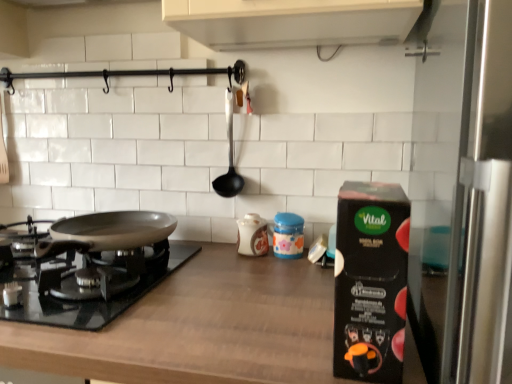
Question: Can you confirm if matte ceramic jar at center, the 2th kitchen appliance when ordered from back to front, is positioned to the right of brown wood countertop at center?

Choices:
 (A) yes
 (B) no

Answer: (A)

Question: Is matte ceramic jar at center, which is the second kitchen appliance in front-to-back order, thinner than brown wood countertop at center?

Choices:
 (A) no
 (B) yes

Answer: (B)

Question: Is brown wood countertop at center surrounded by matte ceramic jar at center, which is the second kitchen appliance in right-to-left order?

Choices:
 (A) yes
 (B) no

Answer: (B)

Question: From the image's perspective, is matte ceramic jar at center, which is the second kitchen appliance in right-to-left order, located above brown wood countertop at center?

Choices:
 (A) no
 (B) yes

Answer: (B)

Question: Is matte ceramic jar at center, which is the second kitchen appliance in front-to-back order, not inside brown wood countertop at center?

Choices:
 (A) no
 (B) yes

Answer: (B)

Question: From a real-world perspective, is matte ceramic jar at center, which is the second kitchen appliance in front-to-back order, under brown wood countertop at center?

Choices:
 (A) yes
 (B) no

Answer: (B)

Question: Is silver metallic pan at lower left directly adjacent to brown wood countertop at center?

Choices:
 (A) no
 (B) yes

Answer: (A)

Question: From the image's perspective, is silver metallic pan at lower left under brown wood countertop at center?

Choices:
 (A) no
 (B) yes

Answer: (A)

Question: Considering the relative positions of silver metallic pan at lower left and brown wood countertop at center in the image provided, is silver metallic pan at lower left to the left of brown wood countertop at center from the viewer's perspective?

Choices:
 (A) yes
 (B) no

Answer: (A)

Question: From a real-world perspective, is silver metallic pan at lower left physically below brown wood countertop at center?

Choices:
 (A) no
 (B) yes

Answer: (A)

Question: Considering the relative sizes of silver metallic pan at lower left and brown wood countertop at center in the image provided, is silver metallic pan at lower left shorter than brown wood countertop at center?

Choices:
 (A) yes
 (B) no

Answer: (A)

Question: Is silver metallic pan at lower left facing away from brown wood countertop at center?

Choices:
 (A) no
 (B) yes

Answer: (A)

Question: Is brown wood countertop at center thinner than black plastic ladle at center?

Choices:
 (A) no
 (B) yes

Answer: (A)